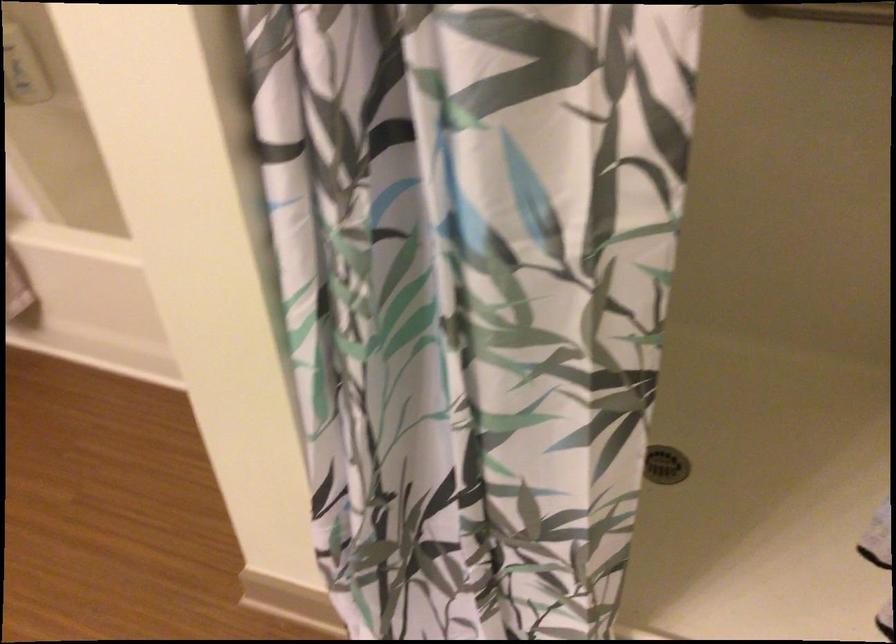
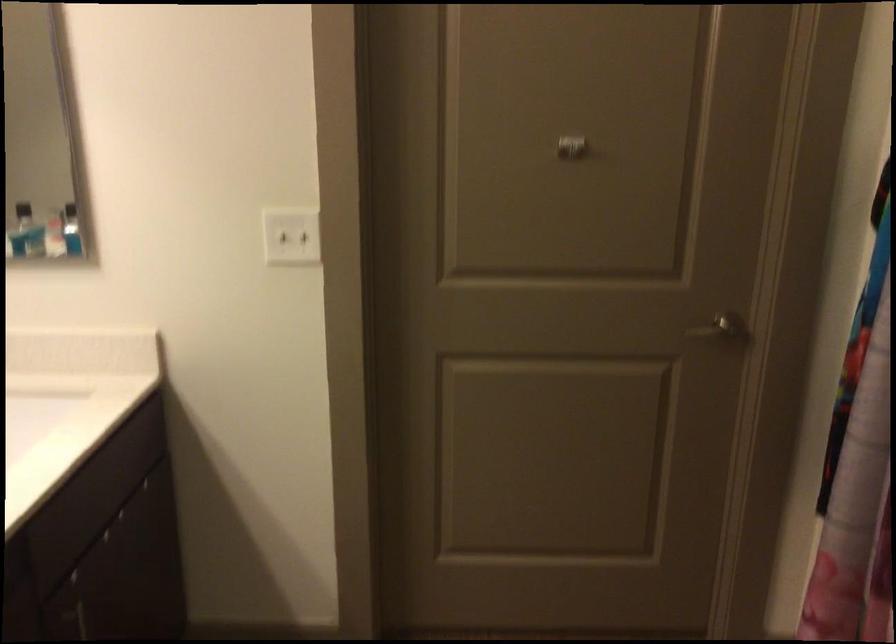
Question: Based on the continuous images, in which direction is the camera rotating? Reply with the corresponding letter.

Choices:
 (A) Left
 (B) Right
 (C) Up
 (D) Down

Answer: (A)